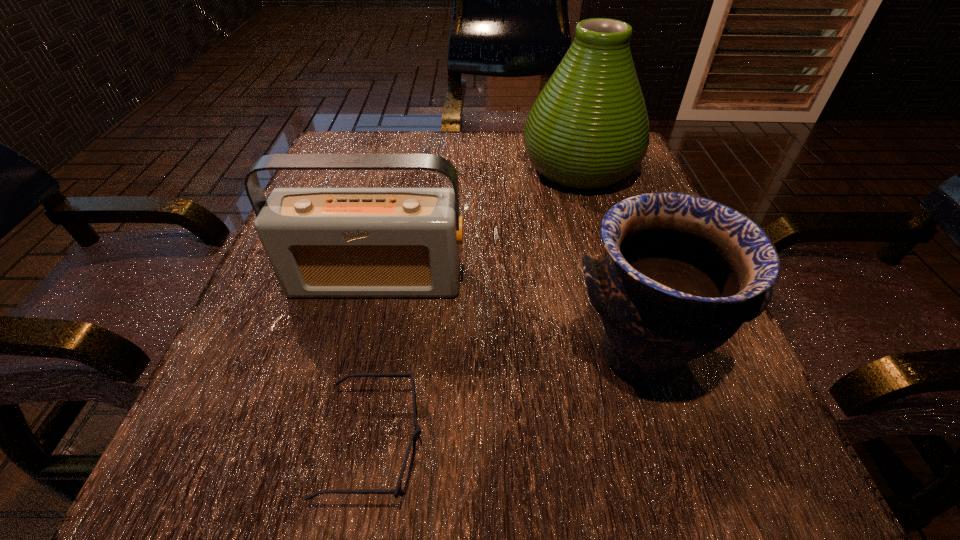
Find the location of a particular element. free point between the second farthest object and the vase is located at coordinates (478, 224).

Locate an element on the screen. free spot between the pottery and the radio receiver is located at coordinates (508, 316).

The height and width of the screenshot is (540, 960). I want to click on free space between the radio receiver and the pottery, so click(508, 316).

Identify the location of free area in between the pottery and the shortest object. The image size is (960, 540). (507, 398).

Locate an element on the screen. The height and width of the screenshot is (540, 960). vacant space in between the farthest object and the radio receiver is located at coordinates (478, 224).

The width and height of the screenshot is (960, 540). In order to click on free point between the second farthest object and the tallest object in this screenshot , I will do [478, 224].

Find the location of a particular element. unoccupied area between the radio receiver and the shortest object is located at coordinates (375, 362).

Where is `free spot between the pottery and the spectacles`? Image resolution: width=960 pixels, height=540 pixels. free spot between the pottery and the spectacles is located at coordinates (507, 398).

Where is `free point between the spectacles and the pottery`? Image resolution: width=960 pixels, height=540 pixels. free point between the spectacles and the pottery is located at coordinates (507, 398).

At what (x,y) coordinates should I click in order to perform the action: click on the closest object to the shortest object. Please return your answer as a coordinate pair (x, y). The image size is (960, 540). Looking at the image, I should click on (321, 242).